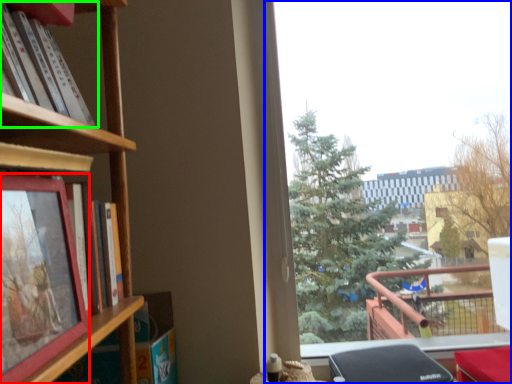
Question: Which is nearer to the picture frame (highlighted by a red box)? window (highlighted by a blue box) or book (highlighted by a green box).

Choices:
 (A) window
 (B) book

Answer: (B)